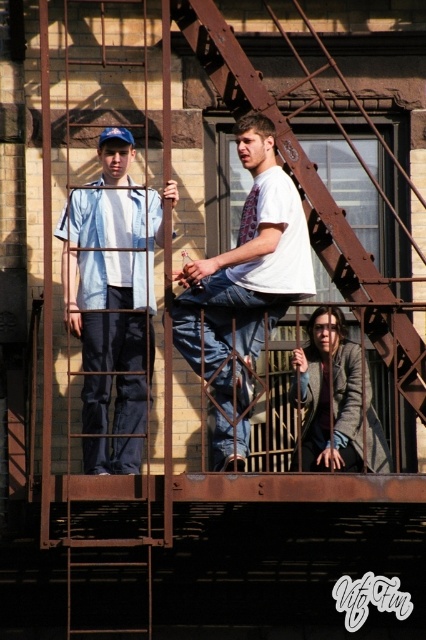
Question: Does white cotton shirt at center appear on the right side of rusty metal fire escape at center?

Choices:
 (A) no
 (B) yes

Answer: (A)

Question: Considering the real-world distances, which object is closest to the rusty metal fire escape at center?

Choices:
 (A) denim shirt at left
 (B) white cotton shirt at center

Answer: (B)

Question: Where is denim shirt at left located in relation to rusty metal fire escape at center in the image?

Choices:
 (A) below
 (B) above

Answer: (A)

Question: Is denim shirt at left above rusty metal fire escape at center?

Choices:
 (A) yes
 (B) no

Answer: (B)

Question: Which object appears closest to the camera in this image?

Choices:
 (A) denim shirt at left
 (B) rusty metal fire escape at center

Answer: (B)

Question: Which point is farther to the camera?

Choices:
 (A) (261, 99)
 (B) (230, 468)

Answer: (A)